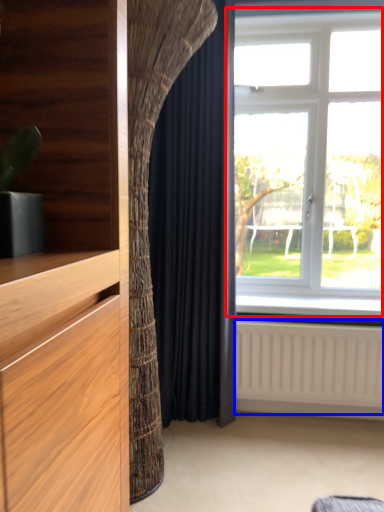
Question: Which of the following is the farthest to the observer, window (highlighted by a red box) or radiator (highlighted by a blue box)?

Choices:
 (A) window
 (B) radiator

Answer: (B)